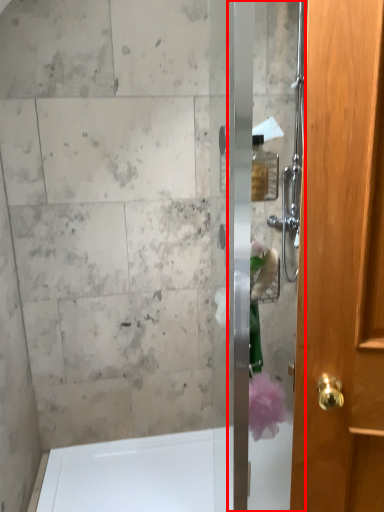
Question: From the image, what is the correct spatial relationship of screen door (annotated by the red box) in relation to bath?

Choices:
 (A) right
 (B) left

Answer: (A)